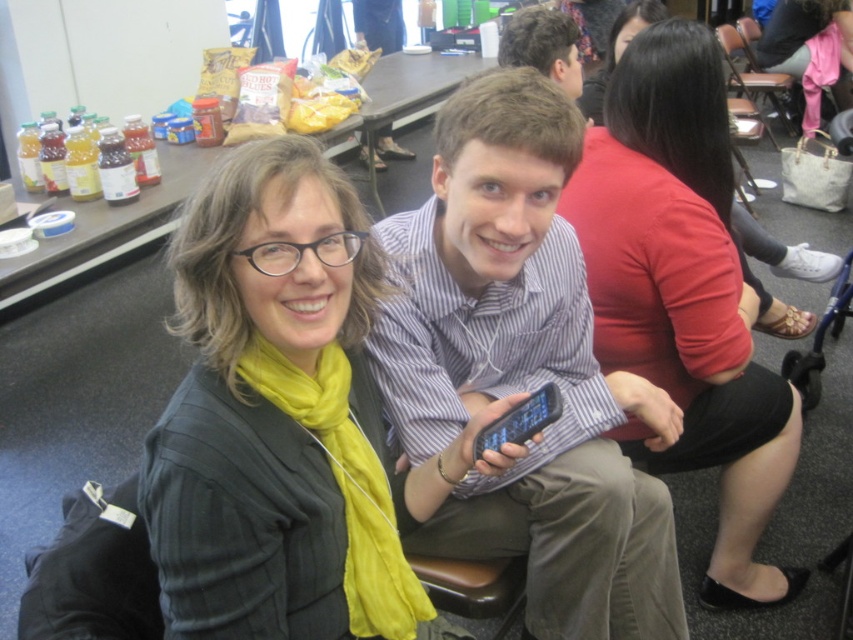
You are standing in the room and want to find the pink fabric at upper right. Based on the coordinates provided in the Objects Description, where should you look relative to the center of the image?

The pink fabric at upper right is located at point coordinates closer to the top right corner of the image compared to the center.

Looking at this image, you are organizing a photo shoot and need to ensure that all items in the frame are visible. Given that the pink fabric at upper right and the matte black shirt at upper center are both in the shot, which object occupies more horizontal space in the image?

The pink fabric at upper right occupies more horizontal space than the matte black shirt at upper center because its width is larger according to the description.

You are organizing a clothing display and need to arrange the striped cotton shirt at center and the pink fabric at upper right. According to the image, which item should be placed to the left when setting them up?

The striped cotton shirt at center should be placed to the left of the pink fabric at upper right as per the image.